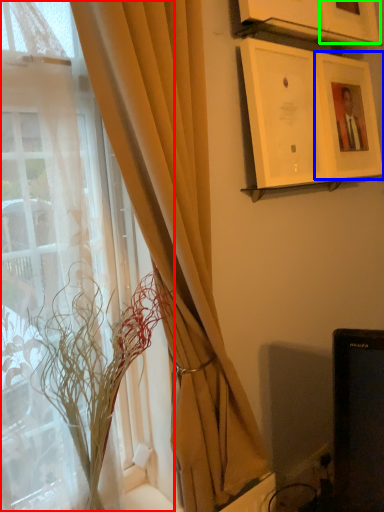
Question: Based on their relative distances, which object is nearer to window (highlighted by a red box)? Choose from picture frame (highlighted by a blue box) and picture frame (highlighted by a green box).

Choices:
 (A) picture frame
 (B) picture frame

Answer: (A)